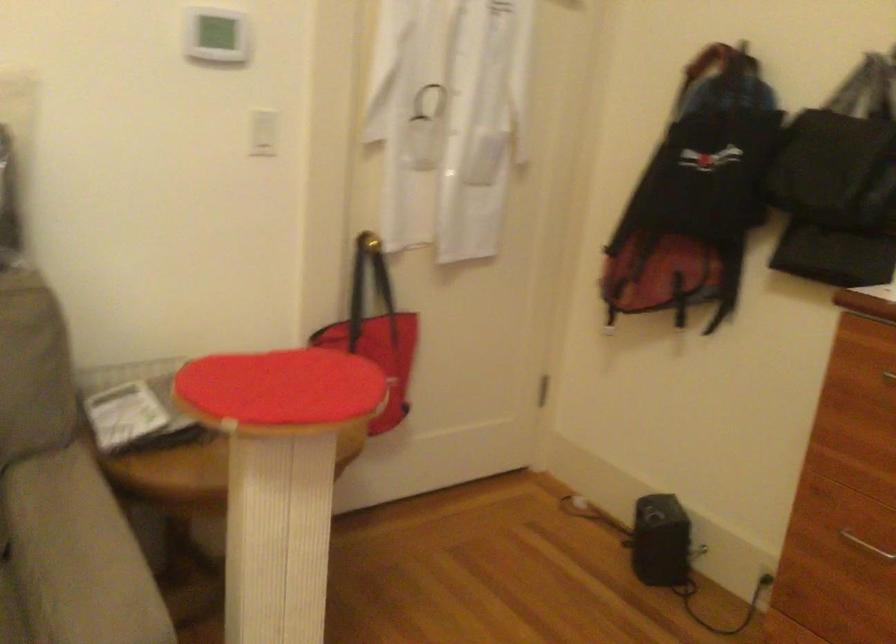
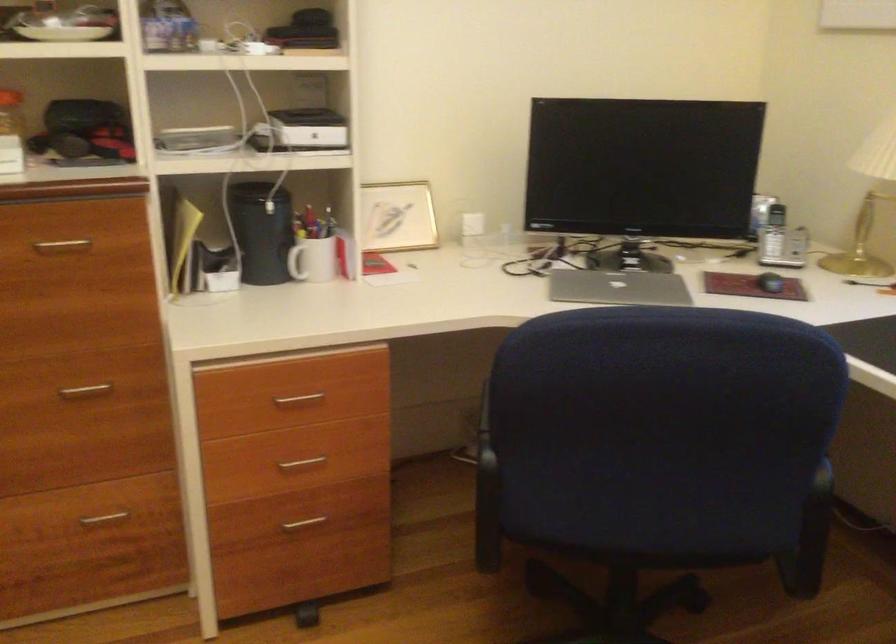
Looking at this image, based on the continuous images, in which direction is the camera rotating?

The rotation direction of the camera is right-down.